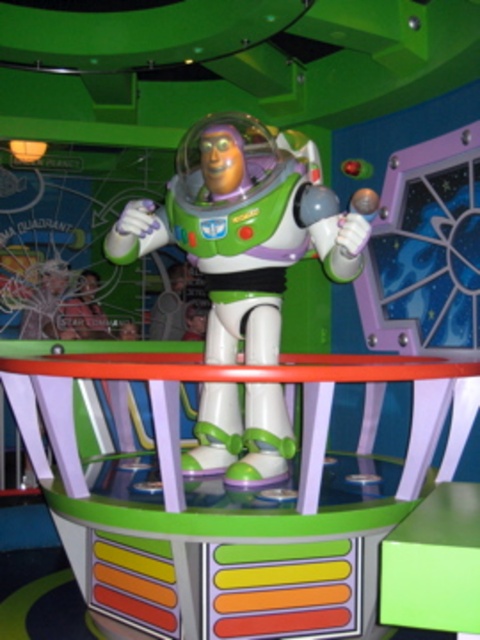
Question: Does white plastic astronaut at center have a greater width compared to green plastic stool at center?

Choices:
 (A) no
 (B) yes

Answer: (B)

Question: Which of the following is the farthest from the observer?

Choices:
 (A) green plastic stool at center
 (B) white plastic astronaut at center

Answer: (B)

Question: Is white plastic astronaut at center wider than green plastic stool at center?

Choices:
 (A) no
 (B) yes

Answer: (B)

Question: Can you confirm if white plastic astronaut at center is wider than green plastic stool at center?

Choices:
 (A) no
 (B) yes

Answer: (B)

Question: Which object appears farthest from the camera in this image?

Choices:
 (A) green plastic stool at center
 (B) white plastic astronaut at center

Answer: (B)